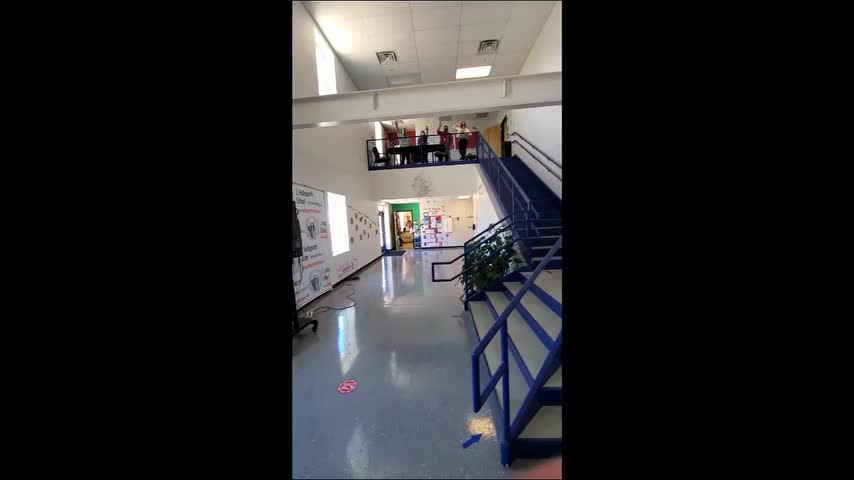
At what (x,y) coordinates should I click in order to perform the action: click on air vent. Please return your answer as a coordinate pair (x, y). The width and height of the screenshot is (854, 480). Looking at the image, I should click on (389, 56), (486, 44).